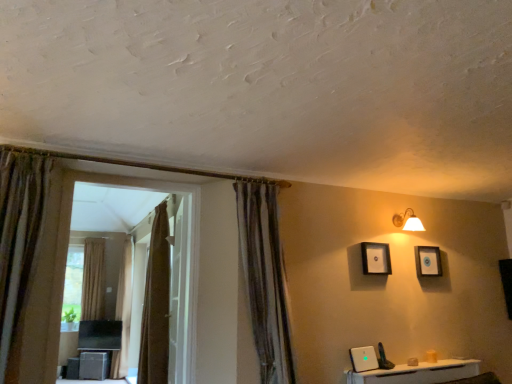
Question: Is matte black picture frame at upper center, acting as the 2th picture frame starting from the right, far away from white glossy door at center?

Choices:
 (A) yes
 (B) no

Answer: (A)

Question: From the image's perspective, is matte black picture frame at upper center, acting as the 2th picture frame starting from the right, located beneath white glossy door at center?

Choices:
 (A) no
 (B) yes

Answer: (A)

Question: Does matte black picture frame at upper center, acting as the 2th picture frame starting from the right, have a greater width compared to white glossy door at center?

Choices:
 (A) yes
 (B) no

Answer: (B)

Question: Does matte black picture frame at upper center, the 1th picture frame when ordered from front to back, contain white glossy door at center?

Choices:
 (A) yes
 (B) no

Answer: (B)

Question: Is matte black picture frame at upper center, the 1th picture frame when ordered from front to back, at the left side of white glossy door at center?

Choices:
 (A) yes
 (B) no

Answer: (B)

Question: Is white glossy door at center wider or thinner than white glossy router at lower right?

Choices:
 (A) thin
 (B) wide

Answer: (A)

Question: In the image, is white glossy door at center on the left side or the right side of white glossy router at lower right?

Choices:
 (A) right
 (B) left

Answer: (B)

Question: In terms of size, does white glossy door at center appear bigger or smaller than white glossy router at lower right?

Choices:
 (A) small
 (B) big

Answer: (B)

Question: From the image's perspective, relative to white glossy router at lower right, is white glossy door at center above or below?

Choices:
 (A) above
 (B) below

Answer: (A)

Question: In the image, is white glossy door at center positioned in front of or behind beige fabric curtain at left, which is counted as the 4th curtain, starting from the right?

Choices:
 (A) front
 (B) behind

Answer: (A)

Question: From the image's perspective, is white glossy door at center above or below beige fabric curtain at left, the 1th curtain when ordered from back to front?

Choices:
 (A) above
 (B) below

Answer: (A)

Question: Is white glossy door at center inside the boundaries of beige fabric curtain at left, the 1th curtain when ordered from back to front, or outside?

Choices:
 (A) outside
 (B) inside

Answer: (A)

Question: Looking at the image, does white glossy door at center seem bigger or smaller compared to beige fabric curtain at left, positioned as the fourth curtain in front-to-back order?

Choices:
 (A) big
 (B) small

Answer: (A)

Question: Would you say white glossy door at center is inside or outside brown textured curtain at left, which ranks as the 3th curtain in right-to-left order?

Choices:
 (A) inside
 (B) outside

Answer: (B)

Question: Is point (182, 375) positioned closer to the camera than point (114, 370)?

Choices:
 (A) closer
 (B) farther

Answer: (A)